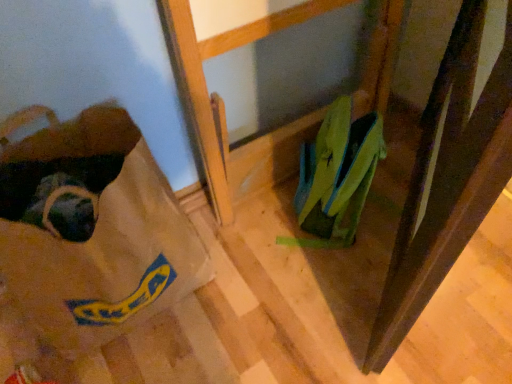
Question: Is brown paper bag at lower left not close to green fabric shoe at lower right?

Choices:
 (A) no
 (B) yes

Answer: (A)

Question: Considering the relative sizes of brown paper bag at lower left and green fabric shoe at lower right in the image provided, is brown paper bag at lower left shorter than green fabric shoe at lower right?

Choices:
 (A) yes
 (B) no

Answer: (B)

Question: From a real-world perspective, is brown paper bag at lower left positioned under green fabric shoe at lower right based on gravity?

Choices:
 (A) no
 (B) yes

Answer: (A)

Question: Is brown paper bag at lower left further to the viewer compared to green fabric shoe at lower right?

Choices:
 (A) yes
 (B) no

Answer: (B)

Question: Is brown paper bag at lower left positioned beyond the bounds of green fabric shoe at lower right?

Choices:
 (A) yes
 (B) no

Answer: (A)

Question: Considering the relative sizes of brown paper bag at lower left and green fabric shoe at lower right in the image provided, is brown paper bag at lower left taller than green fabric shoe at lower right?

Choices:
 (A) no
 (B) yes

Answer: (B)

Question: Is there a large distance between green fabric shoe at lower right and brown paper bag at lower left?

Choices:
 (A) no
 (B) yes

Answer: (A)

Question: Is brown paper bag at lower left inside green fabric shoe at lower right?

Choices:
 (A) no
 (B) yes

Answer: (A)

Question: Is green fabric shoe at lower right positioned beyond the bounds of brown paper bag at lower left?

Choices:
 (A) no
 (B) yes

Answer: (B)

Question: From the image's perspective, is green fabric shoe at lower right above brown paper bag at lower left?

Choices:
 (A) yes
 (B) no

Answer: (A)

Question: Considering the relative sizes of green fabric shoe at lower right and brown paper bag at lower left in the image provided, is green fabric shoe at lower right thinner than brown paper bag at lower left?

Choices:
 (A) yes
 (B) no

Answer: (A)

Question: Is green fabric shoe at lower right beside brown paper bag at lower left?

Choices:
 (A) no
 (B) yes

Answer: (A)

Question: Is brown paper bag at lower left taller or shorter than green fabric shoe at lower right?

Choices:
 (A) tall
 (B) short

Answer: (A)